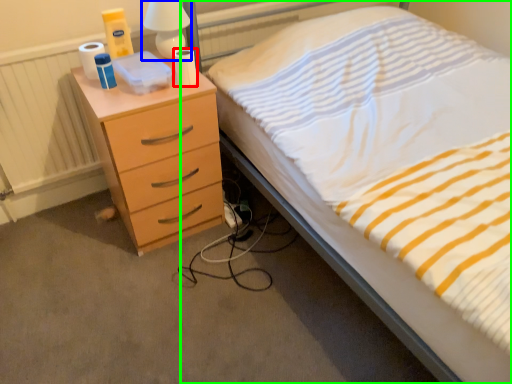
Question: Which object is positioned closest to toilet paper (highlighted by a red box)? Select from bedside lamp (highlighted by a blue box) and bed (highlighted by a green box).

Choices:
 (A) bedside lamp
 (B) bed

Answer: (A)